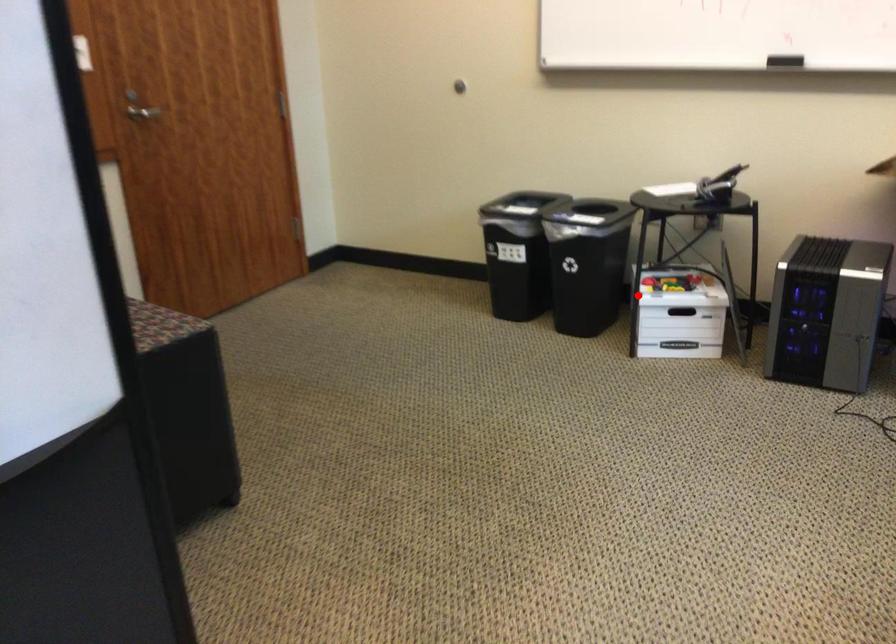
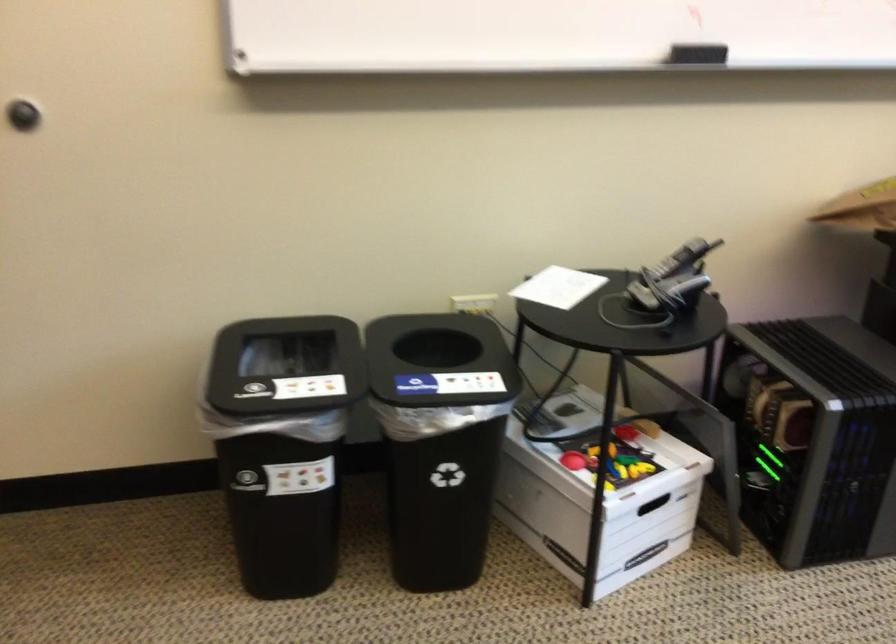
In the second image, find the point that corresponds to the highlighted location in the first image.

(599, 495)